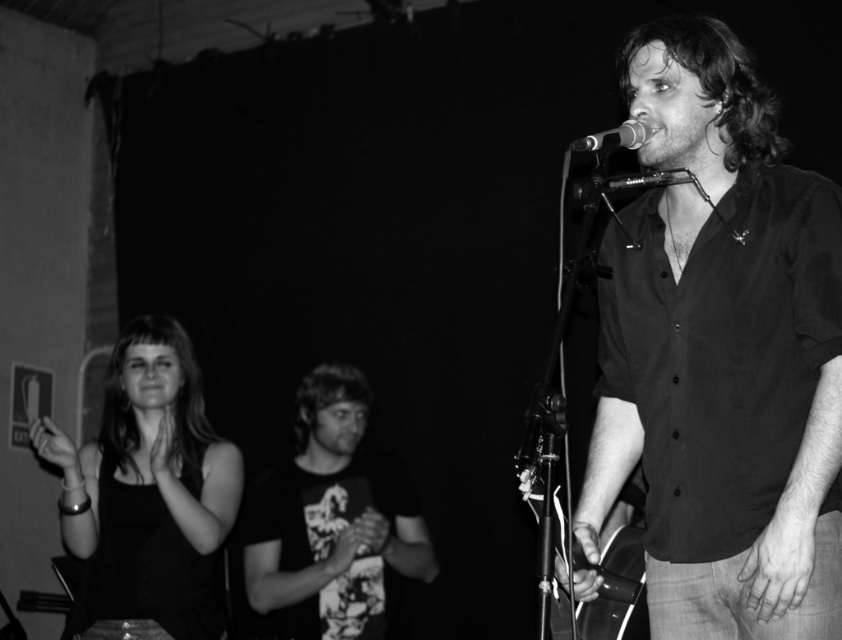
What is located at the coordinates point (721,355)?

The black matte shirt at center is located at point (721,355).

Based on the scene description, can you determine which object is closer to the camera between the black tank top at left and the metallic acoustic guitar at center?

The black tank top at left is closer to the camera because the metallic acoustic guitar at center is behind it.